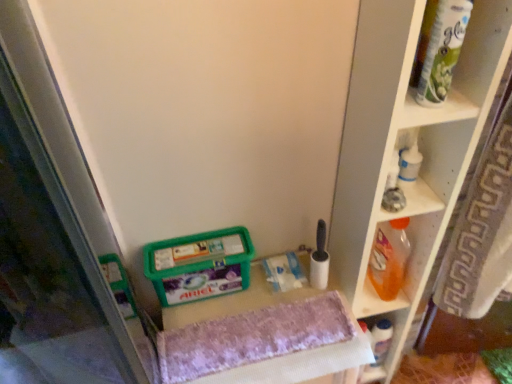
Question: Which is correct: green matte paper towel tube at upper right is inside orange plastic bottle at right, or outside of it?

Choices:
 (A) inside
 (B) outside

Answer: (B)

Question: In terms of height, does green matte paper towel tube at upper right look taller or shorter compared to orange plastic bottle at right?

Choices:
 (A) short
 (B) tall

Answer: (A)

Question: Based on their relative distances, which object is farther from the green matte paper towel tube at upper right?

Choices:
 (A) white plastic shelf at right, the 2th shelf ordered from the bottom
 (B) white plastic bottle at lower right, positioned as the 2th shelf in top-to-bottom order
 (C) green plastic container at lower center
 (D) orange plastic bottle at right
 (E) purple fabric vanity at center

Answer: (B)

Question: Which object is the closest to the orange plastic bottle at right?

Choices:
 (A) white plastic bottle at lower right, the 1th shelf in the bottom-to-top sequence
 (B) white plastic shelf at right, arranged as the 1th shelf when viewed from the top
 (C) green matte paper towel tube at upper right
 (D) purple fabric vanity at center
 (E) green plastic container at lower center

Answer: (A)